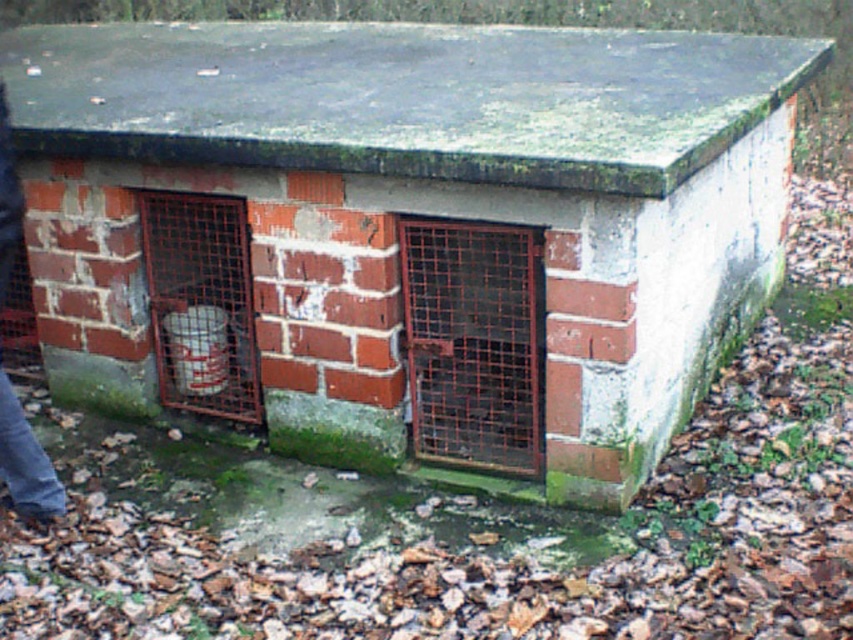
You are standing in front of the brick structure and want to place a small sensor at the point closer to you. Which point should you choose between point (221, 268) and point (9, 419)?

Point (9, 419) is closer to you than point (221, 268), so you should choose point (9, 419) to place the sensor.

You are a farmer who needs to store a large bag of feed. You see the rusty metal cage at center and the white plastic bucket at left. Which container can hold the bag of feed?

The white plastic bucket at left can hold the bag of feed because it is larger than the rusty metal cage at center.